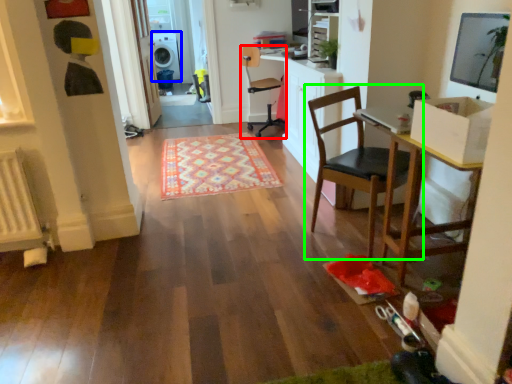
Question: Which object is the farthest from chair (highlighted by a red box)? Choose among these: dish washer (highlighted by a blue box) or chair (highlighted by a green box).

Choices:
 (A) dish washer
 (B) chair

Answer: (A)